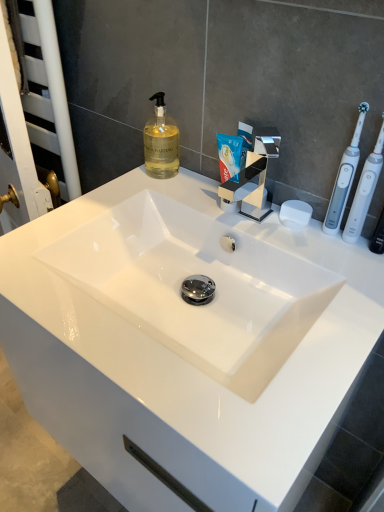
Question: Which is correct: white glossy sink at center is inside white plastic toothbrush at right, the first toothbrush when ordered from right to left, or outside of it?

Choices:
 (A) outside
 (B) inside

Answer: (A)

Question: From the image's perspective, is white glossy sink at center located above or below white plastic toothbrush at right, positioned as the second toothbrush in left-to-right order?

Choices:
 (A) below
 (B) above

Answer: (A)

Question: Which is nearer to the white plastic screen door at left?

Choices:
 (A) white glossy sink at center
 (B) white plastic toothbrush at right, the 1th toothbrush when ordered from left to right
 (C) white matte soap at right
 (D) translucent glass soap dispenser at upper center
 (E) white plastic toothbrush at right, the first toothbrush when ordered from right to left

Answer: (D)

Question: Considering the real-world distances, which object is closest to the white plastic toothbrush at right, the 2th toothbrush in the right-to-left sequence?

Choices:
 (A) chrome metallic tap at center
 (B) white matte soap at right
 (C) translucent glass soap dispenser at upper center
 (D) white plastic toothbrush at right, the first toothbrush when ordered from right to left
 (E) white glossy sink at center

Answer: (D)